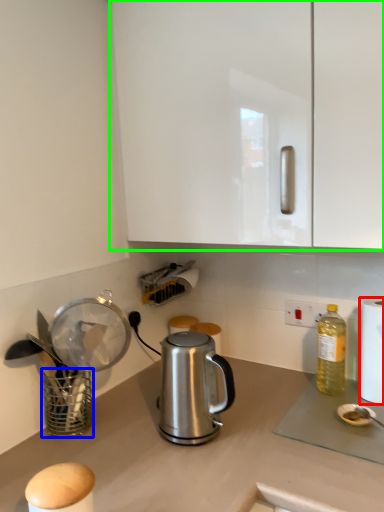
Question: Which object is the farthest from paper towel (highlighted by a red box)? Choose among these: basket (highlighted by a blue box) or cabinetry (highlighted by a green box).

Choices:
 (A) basket
 (B) cabinetry

Answer: (A)